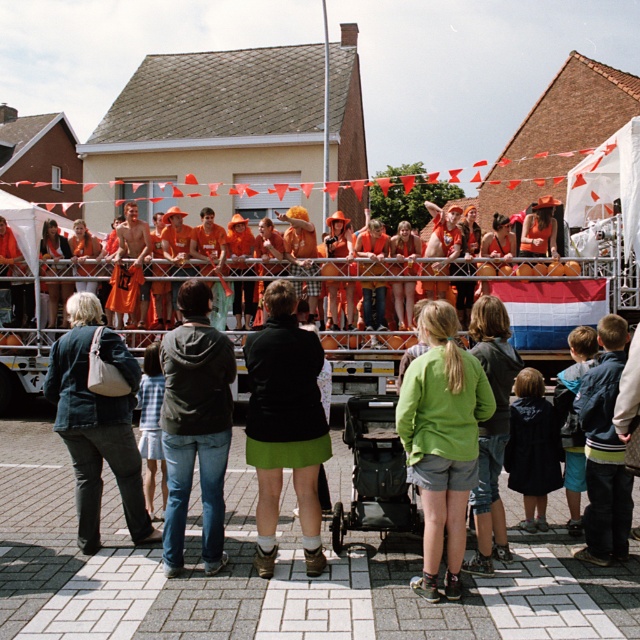
You are organizing a clothing donation drive and need to know which item takes up more space in the donation box. Based on the scene, which item between the dark gray hoodie at center and the denim jacket at center is wider?

The denim jacket at center is wider than the dark gray hoodie at center, so it takes up more space in the donation box.

You are a photographer standing at the back of the crowd. You want to take a photo that includes both the green fabric shorts at center and the denim jacket at center. Given that your camera has a maximum focus range of 2 meters, will you be able to capture both objects in focus at the same time?

The green fabric shorts at center and denim jacket at center are 2.35 meters apart. Since the distance between them exceeds the camera maximum focus range of 2 meters, you won

You are standing in the crowd at the community event. You see the green skirt at center. Where exactly is the green skirt located in terms of coordinates?

The green skirt at center is located at coordinates point (284, 424).